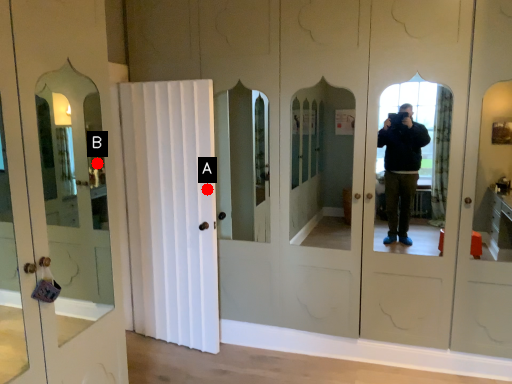
Question: Two points are circled on the image, labeled by A and B beside each circle. Which point is farther from the camera taking this photo?

Choices:
 (A) A is further
 (B) B is further

Answer: (A)